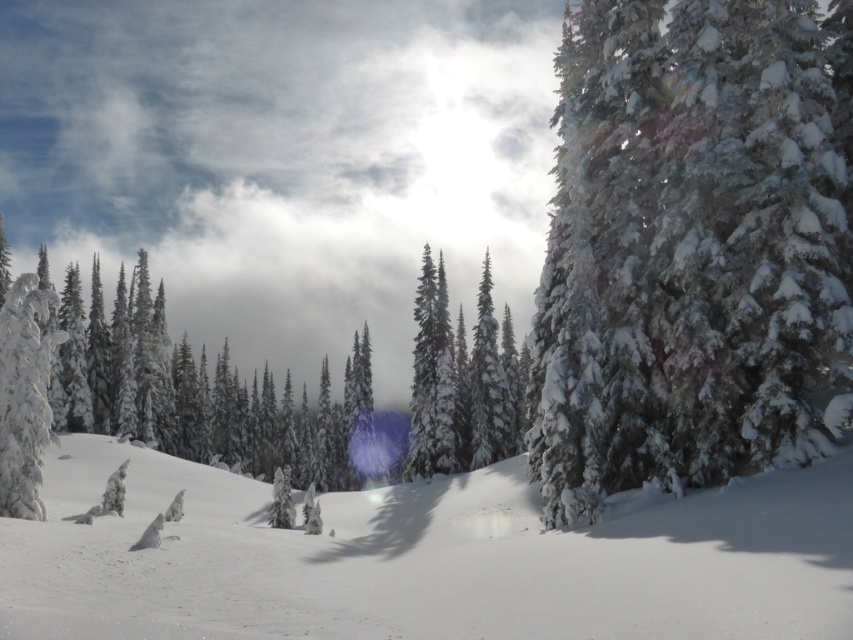
You are a photographer standing in the winter landscape and want to capture a photo where the green matte tree at center is positioned above the white frosty tree at center. Based on the current arrangement, is this possible without moving any trees?

The green matte tree at center is currently below the white frosty tree at center, so it is not possible to position it above without moving the trees.

You are a photographer trying to capture the two trees in the center of the winter scene. You want to position yourself so that the green matte tree at center is on your left side and the white frosty tree at center is on your right side. Based on their positions, which direction should you face to achieve this?

Since the green matte tree at center is to the left of the white frosty tree at center, you should face towards the right side of the scene so that the green matte tree at center appears on your left and the white frosty tree at center is on your right.

You are a photographer standing in the winter landscape and want to take a photo of both the green matte tree at center and the white frosty tree at center. Which tree should you focus on first to ensure both are in sharp focus?

You should focus on the green matte tree at center first because it is in front of the white frosty tree at center, so by focusing on the closer object, both will be in focus if they are within the depth of field.